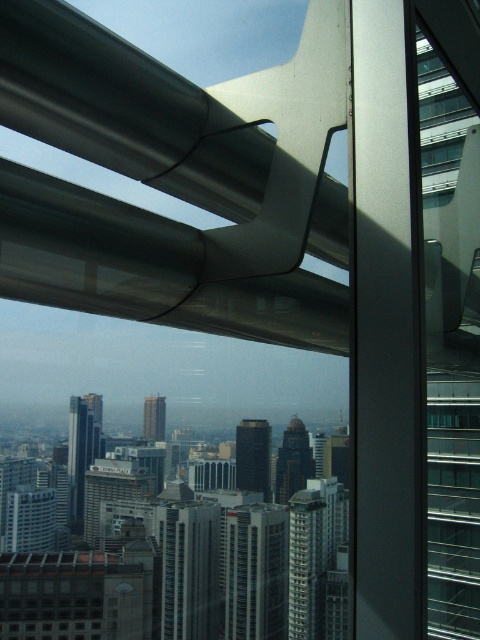
Can you confirm if glassy reflective building at center is bigger than glassy reflective skyscraper at center?

Indeed, glassy reflective building at center has a larger size compared to glassy reflective skyscraper at center.

Who is shorter, glassy reflective building at center or glassy reflective skyscraper at center?

With less height is glassy reflective skyscraper at center.

Does point (276, 541) come farther from viewer compared to point (84, 445)?

Yes, it is behind point (84, 445).

Where is `glassy reflective building at center`? The width and height of the screenshot is (480, 640). glassy reflective building at center is located at coordinates (256, 572).

Is glassy reflective building at center bigger than dark brown glass tower at center?

Indeed, glassy reflective building at center has a larger size compared to dark brown glass tower at center.

Between point (288, 548) and point (303, 460), which one is positioned behind?

The point (288, 548) is more distant.

Which is behind, point (228, 515) or point (291, 448)?

The point (228, 515) is behind.

Find the location of `glassy reflective building at center`. glassy reflective building at center is located at coordinates (256, 572).

Is point (178, 502) farther from camera compared to point (287, 433)?

Yes, it is behind point (287, 433).

Can you confirm if gray concrete building at center is positioned above dark brown glass tower at center?

No.

Is point (176, 513) in front of point (294, 458)?

No, (176, 513) is behind (294, 458).

The image size is (480, 640). In order to click on gray concrete building at center in this screenshot , I will do `click(189, 568)`.